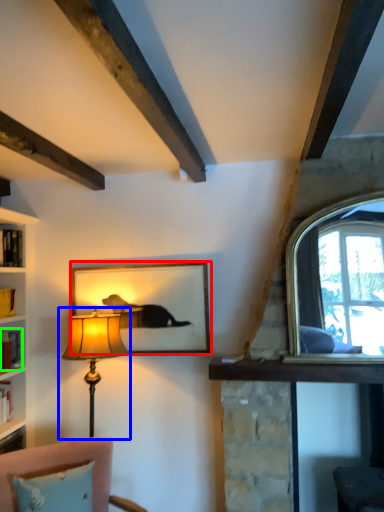
Question: Which object is positioned farthest from picture frame (highlighted by a red box)? Select from lamp (highlighted by a blue box) and book (highlighted by a green box).

Choices:
 (A) lamp
 (B) book

Answer: (B)